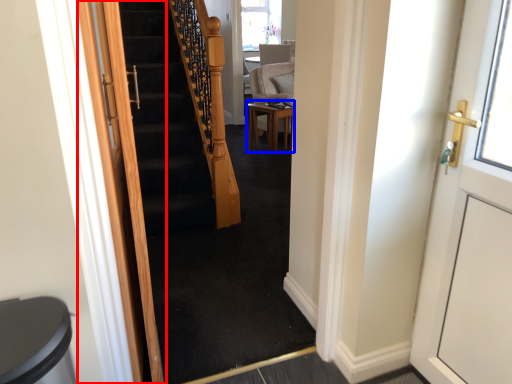
Question: Which of the following is the farthest to the observer, door (highlighted by a red box) or table (highlighted by a blue box)?

Choices:
 (A) door
 (B) table

Answer: (B)